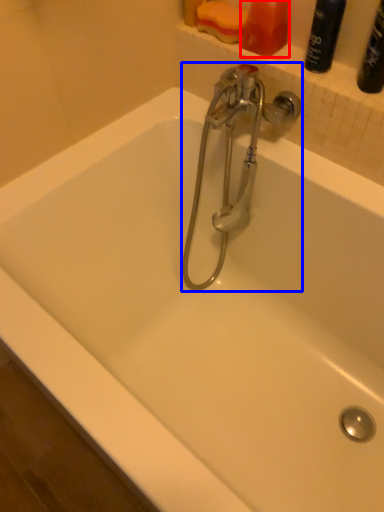
Question: Which point is further to the camera, toiletry (highlighted by a red box) or tap (highlighted by a blue box)?

Choices:
 (A) toiletry
 (B) tap

Answer: (A)